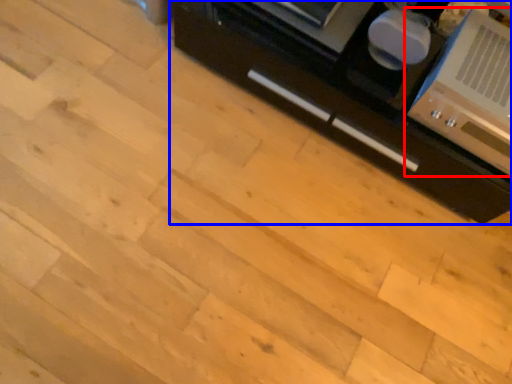
Question: Which of the following is the farthest to the observer, home appliance (highlighted by a red box) or cabinetry (highlighted by a blue box)?

Choices:
 (A) home appliance
 (B) cabinetry

Answer: (B)